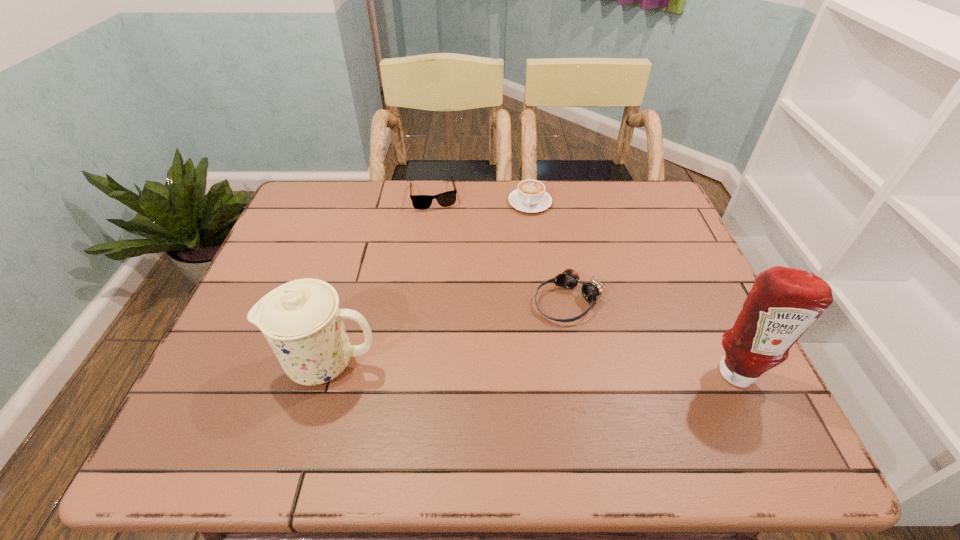
The width and height of the screenshot is (960, 540). I want to click on the second tallest object, so click(301, 320).

Image resolution: width=960 pixels, height=540 pixels. I want to click on the rightmost object, so click(x=783, y=303).

Identify the location of the tallest object. (783, 303).

Identify the location of cappuccino. (530, 196).

The width and height of the screenshot is (960, 540). I want to click on goggles, so click(591, 290).

In order to click on sunglasses in this screenshot , I will do `click(421, 202)`.

Locate an element on the screen. The image size is (960, 540). free space located on the spout of the fourth shortest object is located at coordinates (233, 363).

Locate an element on the screen. Image resolution: width=960 pixels, height=540 pixels. vacant space situated on the spout of the fourth shortest object is located at coordinates (215, 363).

Locate an element on the screen. Image resolution: width=960 pixels, height=540 pixels. free spot located 0.330m on the back of the rightmost object is located at coordinates (680, 253).

Locate an element on the screen. This screenshot has height=540, width=960. blank space located 0.260m on the side of the cappuccino with the handle is located at coordinates (512, 275).